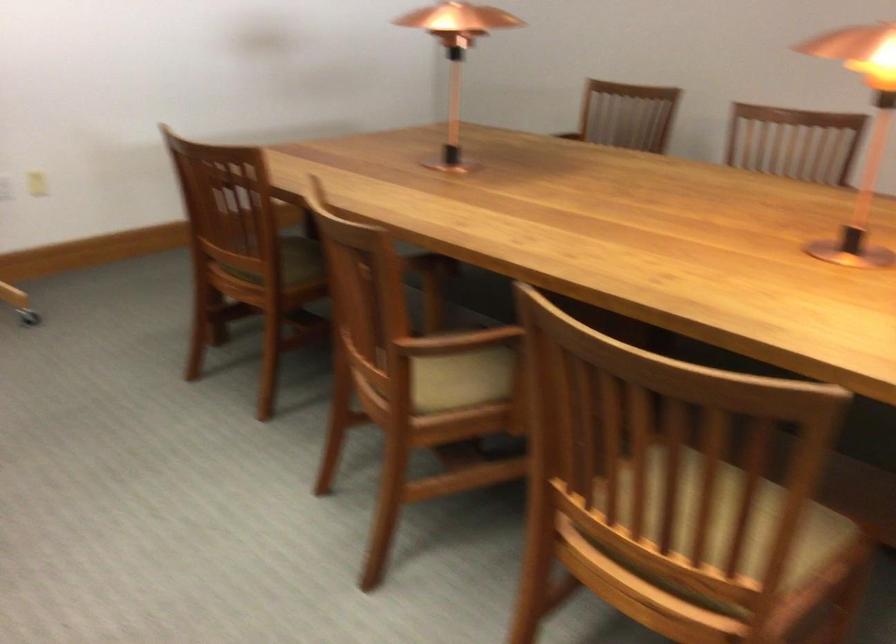
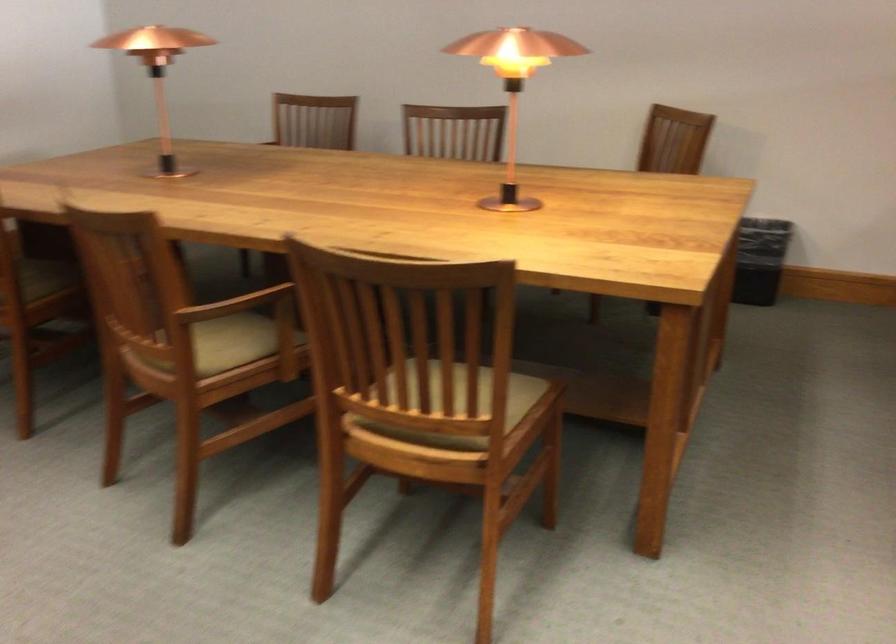
Where in the second image is the point corresponding to point 455,53 from the first image?

(159, 73)